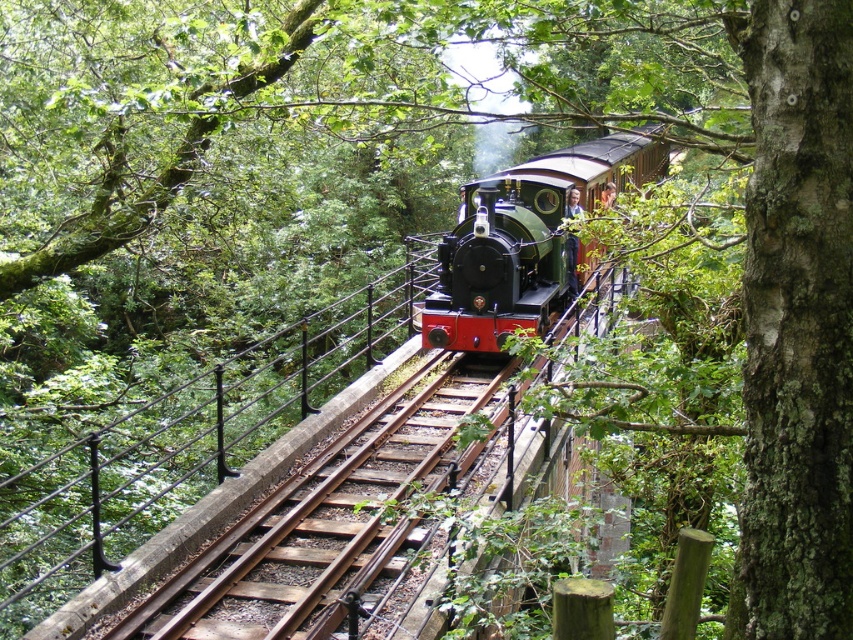
You are a photographer standing on the platform and want to take a picture of the polished green locomotive at center. However, there is a black metal rail at center blocking your view. Can you still see the entire locomotive in your photo?

The black metal rail at center is closer to the viewer than the polished green locomotive at center, so the rail may partially block the view of the locomotive. However, since the rail is at the center and the locomotive is behind it, you might still see parts of the locomotive beyond the rail. Adjust your angle to avoid the rail for a clear shot.

You are standing at the edge of the railway embankment and want to determine which of the two points, point (115, 468) or point (549, 275), is nearer to you. Based on the scene, which point is closer?

Point (115, 468) is closer to the viewer than point (549, 275).

In the scene shown: You are a railway inspector checking the safety of the tracks. You notice the black metal rail at center and the polished green locomotive at center. Which object is smaller in size?

The black metal rail at center has a smaller size compared to the polished green locomotive at center, so the black metal rail at center is smaller.